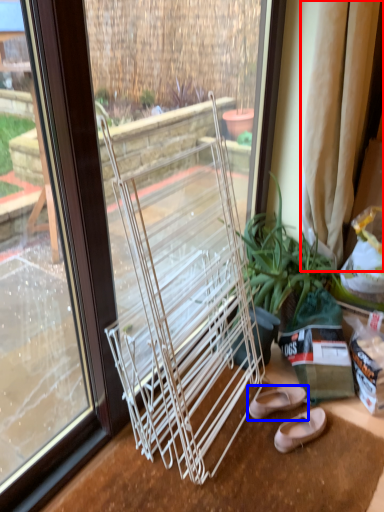
Question: Which object appears farthest to the camera in this image, curtain (highlighted by a red box) or footwear (highlighted by a blue box)?

Choices:
 (A) curtain
 (B) footwear

Answer: (B)